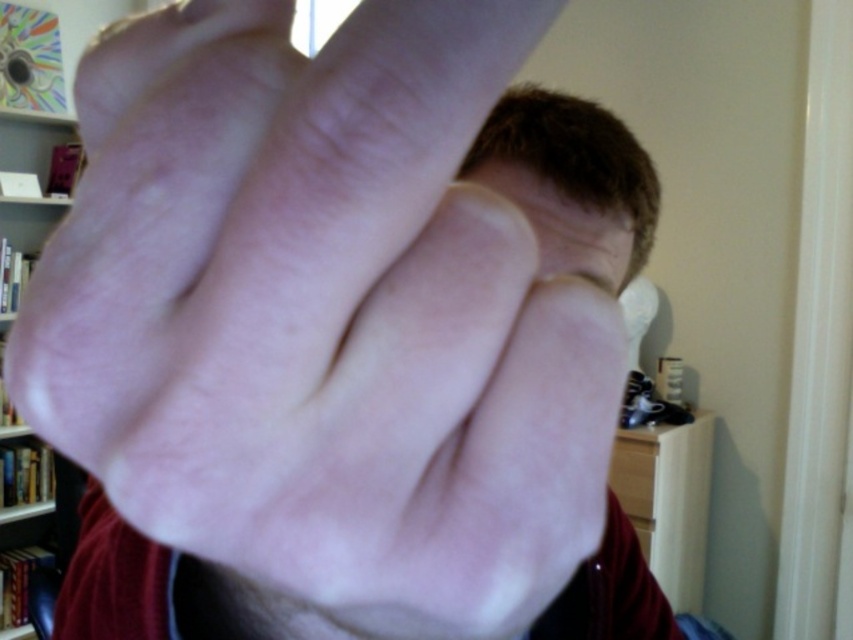
This screenshot has height=640, width=853. What do you see at coordinates (563, 224) in the screenshot? I see `smooth skin at center` at bounding box center [563, 224].

Is point (604, 234) farther from viewer compared to point (6, 316)?

No.

I want to click on smooth skin at center, so click(563, 224).

Which is behind, point (376, 353) or point (16, 218)?

Positioned behind is point (16, 218).

Who is lower down, smooth skin hand at center or white wooden bookshelf at upper left?

smooth skin hand at center

Is point (422, 364) positioned in front of point (27, 266)?

Yes, it is.

Find the location of `smooth skin hand at center`. smooth skin hand at center is located at coordinates (323, 320).

Which is below, smooth skin hand at center or smooth skin at center?

smooth skin hand at center

Between smooth skin hand at center and smooth skin at center, which one appears on the right side from the viewer's perspective?

Positioned to the right is smooth skin at center.

The image size is (853, 640). In order to click on smooth skin hand at center in this screenshot , I will do `click(323, 320)`.